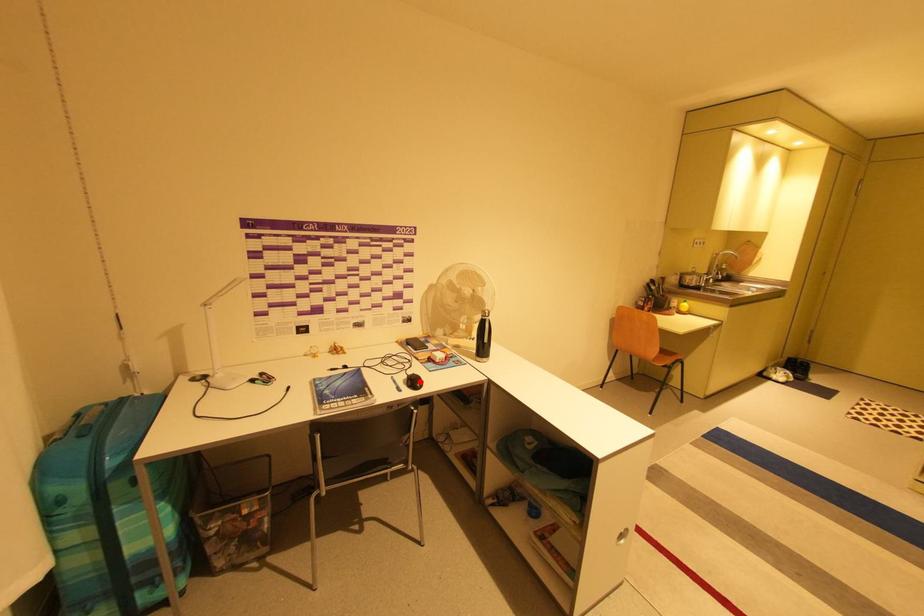
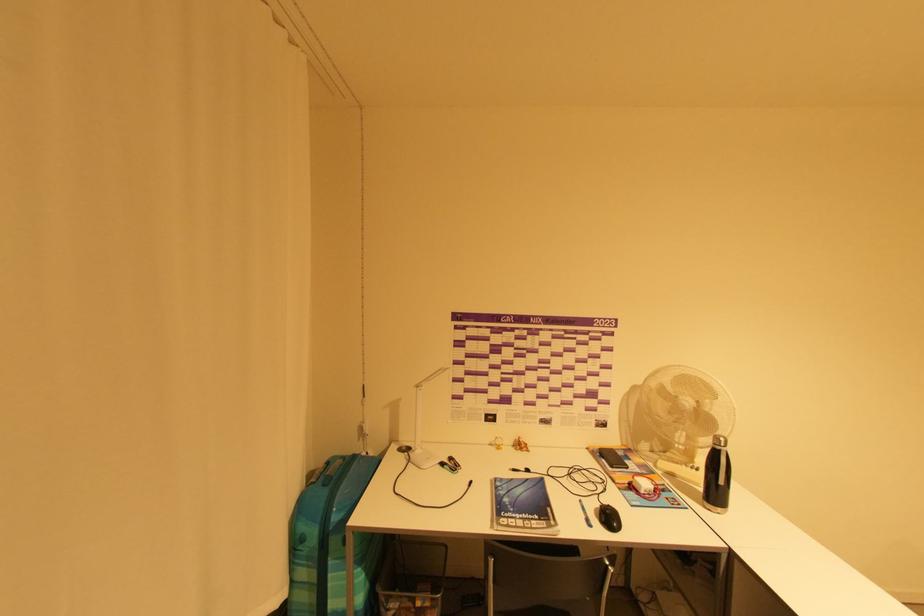
Locate, in the second image, the point that corresponds to the highlighted location in the first image.

(614, 517)